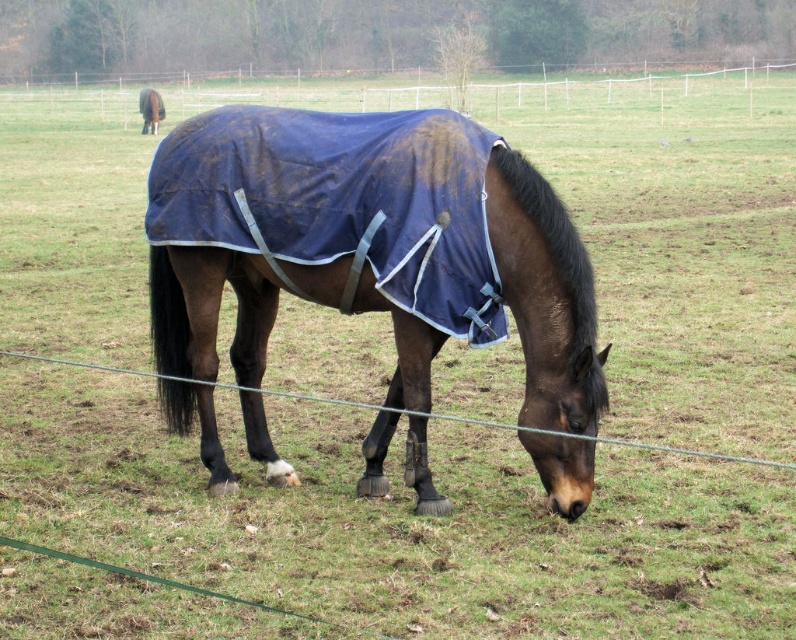
Question: Among these objects, which one is farthest from the camera?

Choices:
 (A) dull blue fabric at center
 (B) white plastic fence at upper center
 (C) brown glossy horse at upper left

Answer: (C)

Question: Does white plastic fence at upper center appear over brown glossy horse at upper left?

Choices:
 (A) no
 (B) yes

Answer: (B)

Question: Considering the relative positions of blue fabric blanket at center and white plastic fence at upper center in the image provided, where is blue fabric blanket at center located with respect to white plastic fence at upper center?

Choices:
 (A) right
 (B) left

Answer: (A)

Question: Which object appears farthest from the camera in this image?

Choices:
 (A) blue fabric blanket at center
 (B) brown glossy horse at upper left
 (C) dull blue fabric at center
 (D) white plastic fence at upper center

Answer: (B)

Question: Observing the image, what is the correct spatial positioning of blue fabric blanket at center in reference to brown glossy horse at upper left?

Choices:
 (A) right
 (B) left

Answer: (A)

Question: Which point is farther to the camera?

Choices:
 (A) blue fabric blanket at center
 (B) dull blue fabric at center
 (C) white plastic fence at upper center

Answer: (C)